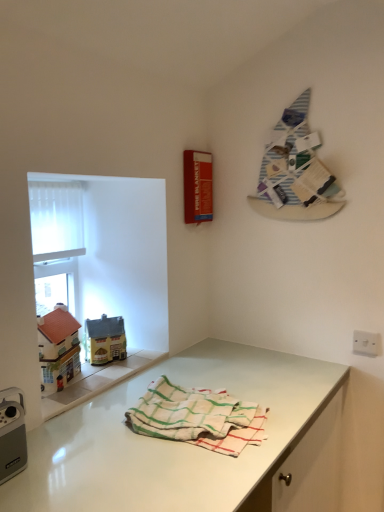
Where is `free location in front of matte yellow house at left, the 1th toy when ordered from right to left`? free location in front of matte yellow house at left, the 1th toy when ordered from right to left is located at coordinates pos(98,375).